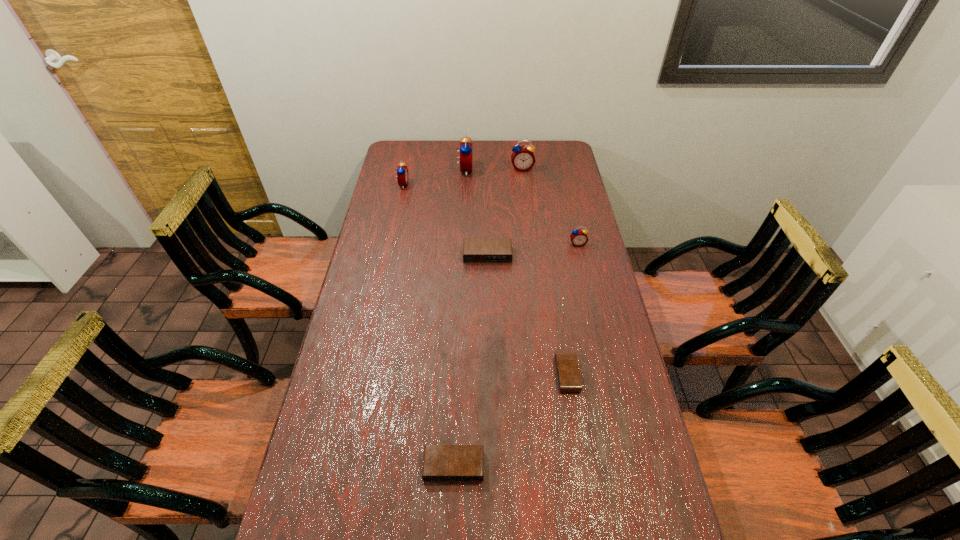
Find the location of a particular element. This screenshot has height=540, width=960. the sixth tallest alarm clock is located at coordinates (440, 462).

In order to click on the nearest alarm clock in this screenshot , I will do `click(440, 462)`.

This screenshot has height=540, width=960. Identify the location of the sixth farthest object. (x=568, y=375).

Find the location of a particular element. the second nearest alarm clock is located at coordinates (568, 375).

Where is `vacant region located 0.190m on the front-facing side of the third red alarm clock from right to left`? vacant region located 0.190m on the front-facing side of the third red alarm clock from right to left is located at coordinates (514, 170).

Where is `free region located on the front-facing side of the sixth shortest object`? free region located on the front-facing side of the sixth shortest object is located at coordinates click(x=526, y=204).

You are a GUI agent. You are given a task and a screenshot of the screen. Output one action in this format:
    pyautogui.click(x=<x>, y=<y>)
    Task: Click on the blank area located 0.100m on the front-facing side of the second nearest red alarm clock
    Image resolution: width=960 pixels, height=540 pixels.
    Given the screenshot: What is the action you would take?
    pyautogui.click(x=431, y=185)

At what (x,y) coordinates should I click in order to perform the action: click on vacant space located 0.090m on the front-facing side of the smallest red alarm clock. Please return your answer as a coordinate pair (x, y). Looking at the image, I should click on (583, 264).

Identify the location of free space located on the front face of the fifth tallest alarm clock. The image size is (960, 540). click(x=488, y=289).

Find the location of a particular element. Image resolution: width=960 pixels, height=540 pixels. free space located on the front face of the second shortest alarm clock is located at coordinates (452, 517).